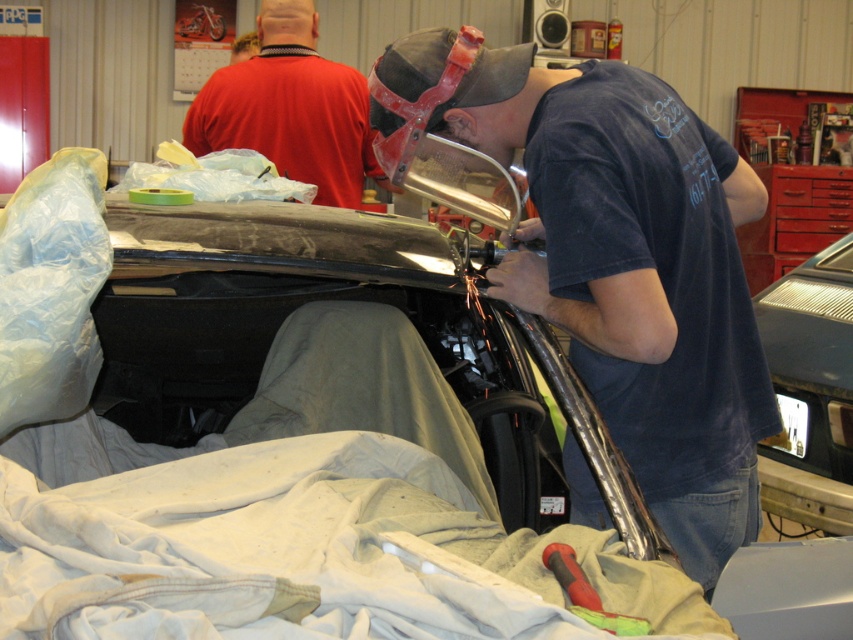
Question: Can you confirm if matte black helmet at center is positioned to the left of metallic silver car at lower right?

Choices:
 (A) no
 (B) yes

Answer: (B)

Question: Based on their relative distances, which object is farther from the red matte shirt at upper center?

Choices:
 (A) metallic silver car at lower right
 (B) matte black helmet at center

Answer: (B)

Question: Which point is closer to the camera taking this photo?

Choices:
 (A) pos(633,436)
 (B) pos(366,168)
 (C) pos(782,394)

Answer: (A)

Question: Among these points, which one is farthest from the camera?

Choices:
 (A) (320, 81)
 (B) (508, 266)

Answer: (A)

Question: Is matte black helmet at center smaller than red matte shirt at upper center?

Choices:
 (A) yes
 (B) no

Answer: (A)

Question: Can you confirm if red matte shirt at upper center is bigger than metallic silver car at lower right?

Choices:
 (A) yes
 (B) no

Answer: (B)